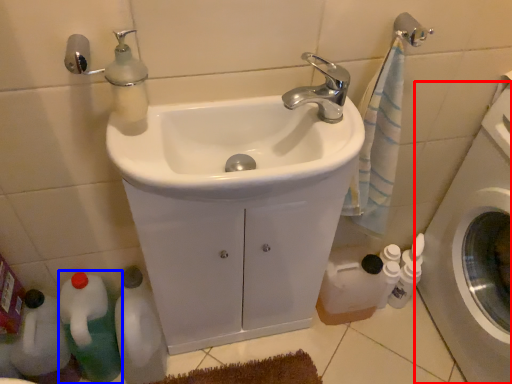
Question: Which object is closer to the camera taking this photo, washing machine (highlighted by a red box) or bottle (highlighted by a blue box)?

Choices:
 (A) washing machine
 (B) bottle

Answer: (A)